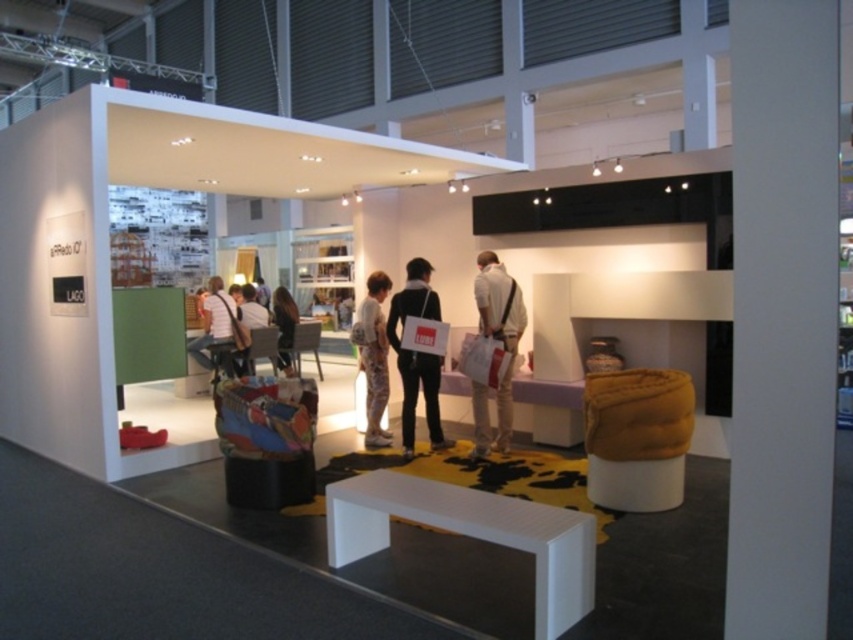
Question: Does white smooth pillar at center appear on the right side of white textured dress at center?

Choices:
 (A) no
 (B) yes

Answer: (B)

Question: Is white fabric chair at center positioned in front of white fabric shirt at center?

Choices:
 (A) yes
 (B) no

Answer: (A)

Question: Which of the following is the closest to the observer?

Choices:
 (A) (293, 301)
 (B) (267, 317)
 (C) (479, 300)

Answer: (C)

Question: Estimate the real-world distances between objects in this image. Which object is closer to the white fabric bag at center?

Choices:
 (A) white fabric chair at center
 (B) white fabric shirt at center
 (C) white smooth pillar at center
 (D) matte black bag at center

Answer: (D)

Question: Which point is farther to the camera?

Choices:
 (A) white fabric bag at center
 (B) brown fabric bag at center
 (C) white fabric chair at center
 (D) white textured dress at center

Answer: (B)

Question: Is white fabric bag at center closer to camera compared to matte black bag at center?

Choices:
 (A) yes
 (B) no

Answer: (B)